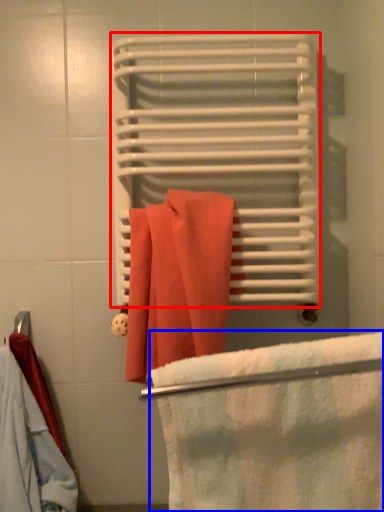
Question: Which point is further to the camera, bath towel (highlighted by a red box) or beach towel (highlighted by a blue box)?

Choices:
 (A) bath towel
 (B) beach towel

Answer: (A)